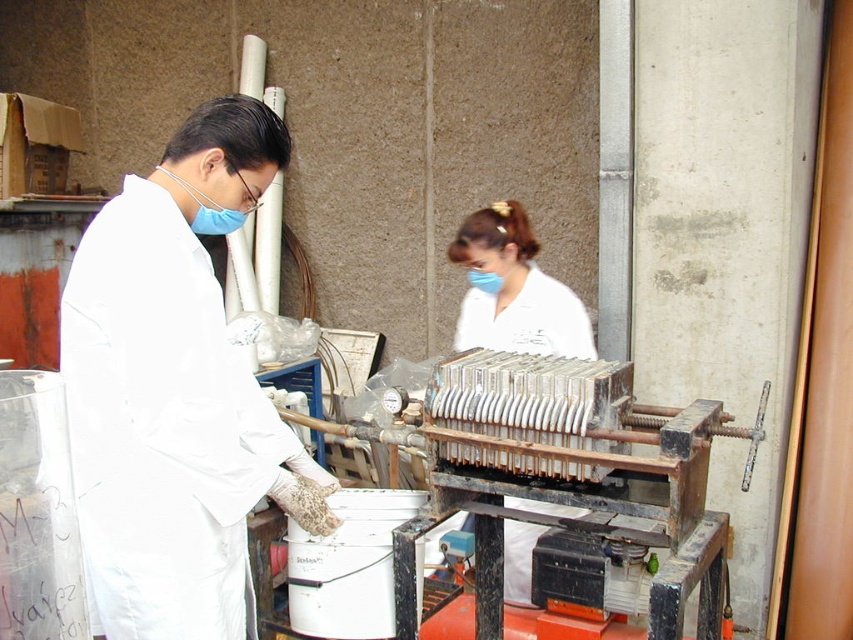
You are a safety inspector in the lab. You need to check the distance between the white matte lab coat at left and the white matte uniform at center. Which one is closer to you?

The white matte lab coat at left is closer to the viewer than the white matte uniform at center, so the lab coat is closer to you.

You are a safety inspector in this lab. You need to ensure that the white matte uniform at center is positioned safely away from the rusty metal press at center. According to the safety protocol, the uniform must be at least 1 meter away from any machinery. Is the current placement compliant with the safety protocol?

The white matte uniform at center is positioned to the left of the rusty metal press at center, but the distance between them is not specified in the description. Therefore, we cannot confirm if the placement meets the safety requirement without additional information.

You are a safety inspector in the lab. You need to check the distance between the white matte lab coat at left and the nearest bucket. The coordinates of the white matte lab coat at left are point [177,392]. Can you determine the distance?

The white matte lab coat at left is represented by point [177,392]. However, without the coordinates of the nearest bucket, it is impossible to calculate the distance between them.